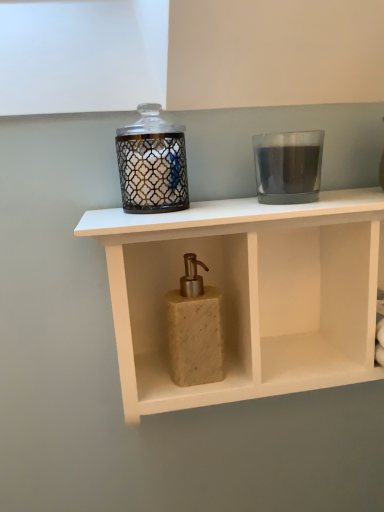
I want to click on vacant space positioned to the left of transparent glass candle at upper right, the second candle holder positioned from the left, so click(x=193, y=210).